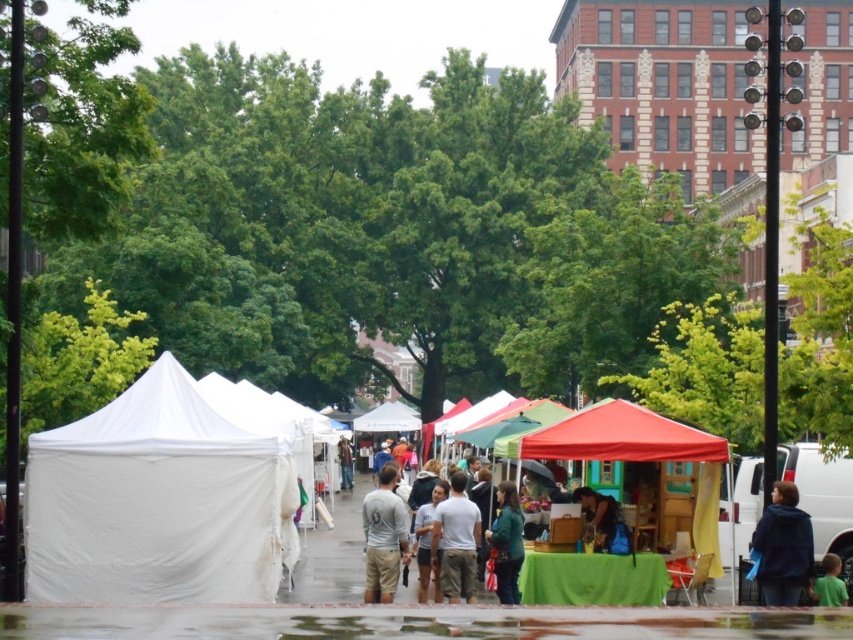
Question: Which object is closer to the camera taking this photo?

Choices:
 (A) gray cotton shirt at center
 (B) light brown cotton pants at center
 (C) light brown leather jacket at center
 (D) dark blue fur coat at lower right

Answer: (D)

Question: Can you confirm if gray cotton shirt at center is smaller than white fabric canopy at center?

Choices:
 (A) yes
 (B) no

Answer: (B)

Question: Among these objects, which one is nearest to the camera?

Choices:
 (A) green fabric at lower right
 (B) red fabric canopy at center
 (C) white fabric canopy at center
 (D) light gray cotton shirt at center

Answer: (A)

Question: Among these objects, which one is farthest from the camera?

Choices:
 (A) gray cotton shirt at center
 (B) green matte jacket at center
 (C) red fabric canopy at center

Answer: (A)

Question: Can you confirm if dark blue fur coat at lower right is wider than matte blue shirt at center?

Choices:
 (A) yes
 (B) no

Answer: (A)

Question: Is green fabric at lower center positioned behind dark blue fur coat at lower right?

Choices:
 (A) yes
 (B) no

Answer: (B)